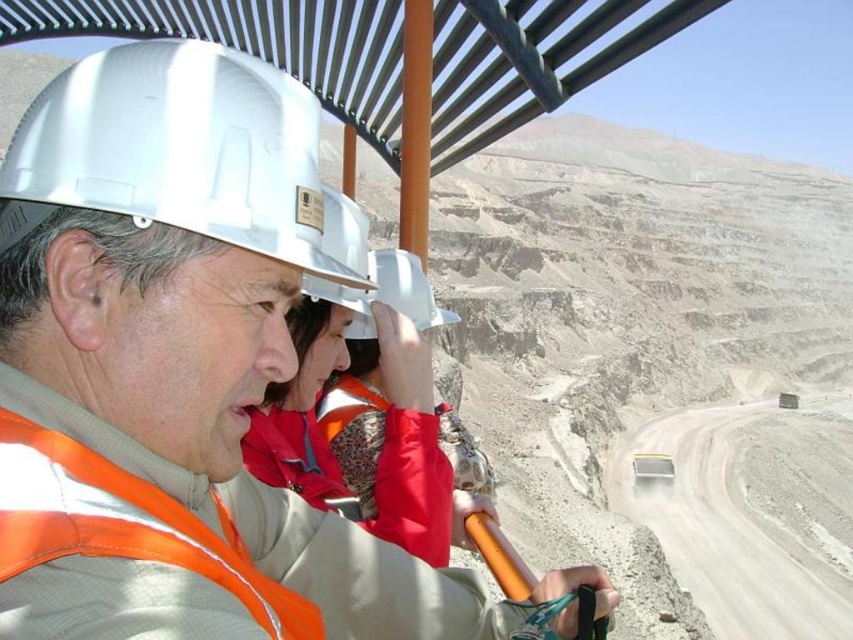
Question: Which of the following is the farthest from the observer?

Choices:
 (A) (16, 410)
 (B) (288, 113)

Answer: (B)

Question: Which point is closer to the camera taking this photo?

Choices:
 (A) (49, 88)
 (B) (154, 474)

Answer: (B)

Question: Does orange reflective vest at center lie in front of white matte hard hat at upper center?

Choices:
 (A) yes
 (B) no

Answer: (A)

Question: Does orange reflective vest at center have a larger size compared to white matte hard hat at upper center?

Choices:
 (A) yes
 (B) no

Answer: (A)

Question: Does orange reflective vest at center appear on the left side of white matte hard hat at upper center?

Choices:
 (A) no
 (B) yes

Answer: (A)